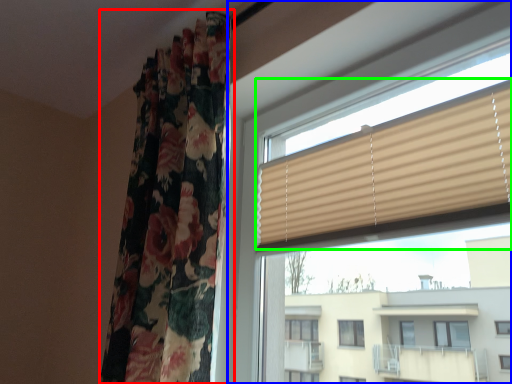
Question: Based on their relative distances, which object is farther from curtain (highlighted by a red box)? Choose from window (highlighted by a blue box) and window blind (highlighted by a green box).

Choices:
 (A) window
 (B) window blind

Answer: (B)